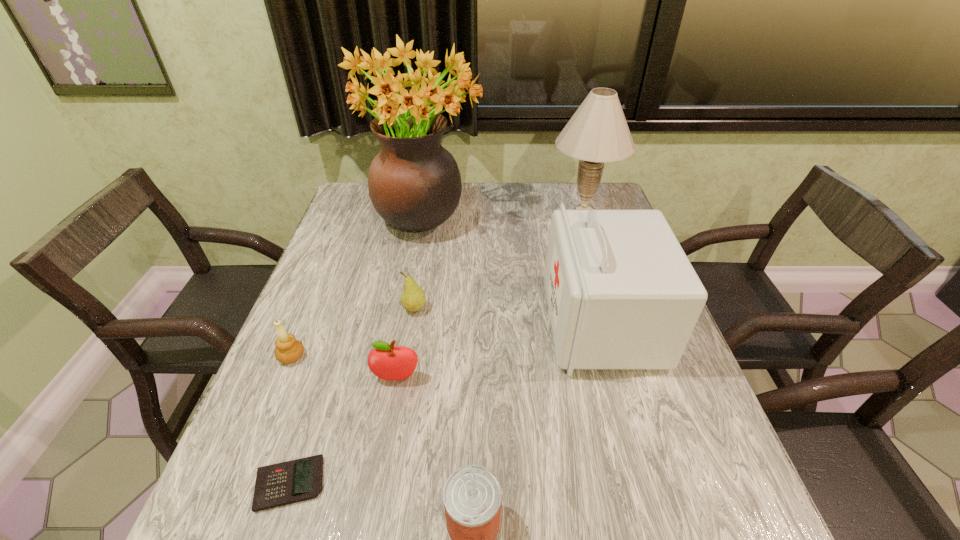
This screenshot has height=540, width=960. Find the location of `vacant region at the far right corner`. vacant region at the far right corner is located at coordinates (609, 205).

This screenshot has width=960, height=540. Find the location of `unoccupied area between the first-aid kit and the candle_holder`. unoccupied area between the first-aid kit and the candle_holder is located at coordinates (446, 340).

You are a GUI agent. You are given a task and a screenshot of the screen. Output one action in this format:
    pyautogui.click(x=<x>, y=<y>)
    Task: Click on the free space between the third tallest object and the shortest object
    This screenshot has width=960, height=540.
    Given the screenshot: What is the action you would take?
    coord(445,403)

You are a GUI agent. You are given a task and a screenshot of the screen. Output one action in this format:
    pyautogui.click(x=<x>, y=<y>)
    Task: Click on the free spot between the lampshade and the calculator
    
    Given the screenshot: What is the action you would take?
    pyautogui.click(x=437, y=346)

Find the location of a particular element. The image size is (960, 540). vacant area that lies between the shortest object and the candle_holder is located at coordinates (291, 420).

Identify the location of vacant area between the apple and the calculator. (343, 431).

Locate an element on the screen. This screenshot has height=540, width=960. unoccupied area between the lampshade and the pear is located at coordinates (499, 259).

Find the location of a particular element. Image resolution: width=960 pixels, height=540 pixels. object that is the fourth closest to the first-aid kit is located at coordinates (387, 362).

Select which object appears as the second closest to the can. Please provide its 2D coordinates. Your answer should be formatted as a tuple, i.e. [(x, y)], where the tuple contains the x and y coordinates of a point satisfying the conditions above.

[(387, 362)]